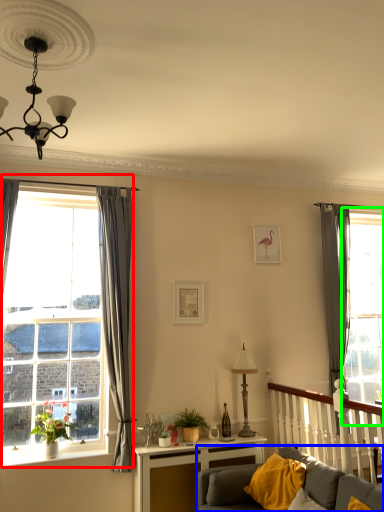
Question: Which is nearer to the window (highlighted by a red box)? studio couch (highlighted by a blue box) or glass door (highlighted by a green box).

Choices:
 (A) studio couch
 (B) glass door

Answer: (A)